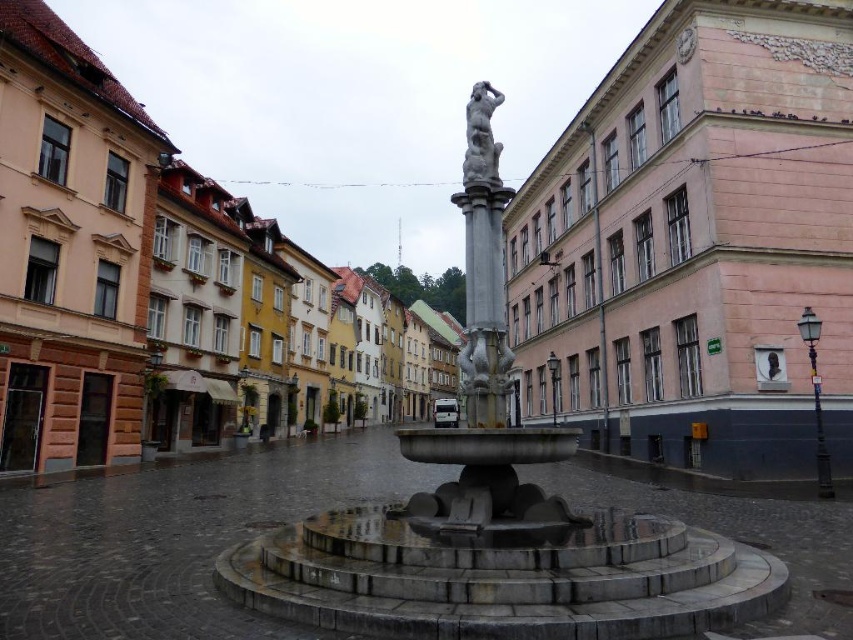
You are an architect designing a new sculpture to be placed near the fountain. You have two options for the base of the sculpture. The first option is a polished stone column at center, and the second is a matte black bust at center. Based on their sizes, which base would provide more stability for a tall statue?

The polished stone column at center has a larger width than the matte black bust at center, so it would provide more stability for a tall statue due to its wider base.

You are a tourist standing in the square and want to take a photo of both the polished stone column at center and the matte black bust at center. Which object should you position to your right side to include both in the frame?

To include both the polished stone column at center and the matte black bust at center in your photo, position the matte black bust at center to your right side since the polished stone column at center is to the left of it.

You are standing at the edge of the square holding a camera. You want to take a photo of the slate gray statue at center. The camera has a maximum zoom range of 20 meters. Can you capture the entire statue in the photo without moving closer?

The slate gray statue at center and camera are 19.99 meters apart from each other, so yes, the camera can capture the entire statue in the photo since the distance is within the maximum zoom range of 20 meters.